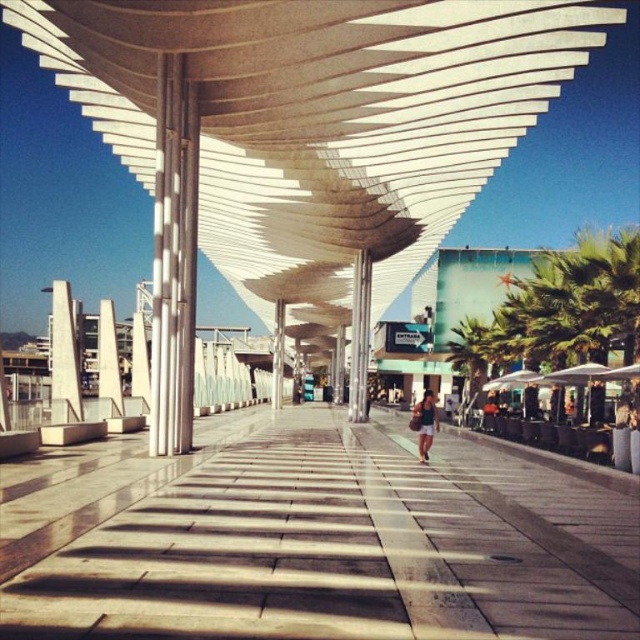
You are a photographer standing at the edge of the plaza, aiming to capture the architectural canopy and the objects on the ground. Which object, the white polished stone pavement at center or the matte black shorts at center, is closer to the camera based on their height?

The matte black shorts at center is taller than the white polished stone pavement at center, so the matte black shorts at center is closer to the camera.

You are a pedestrian walking on the white polished stone pavement at center and the matte black shorts at center. Which surface is more likely to reflect sunlight and cause glare?

The white polished stone pavement at center is positioned under matte black shorts at center. Since white polished stone is more reflective than matte black material, the white polished stone pavement at center is more likely to reflect sunlight and cause glare.

You are standing at the edge of the plaza and want to walk towards the white polished stone pavement at center and the matte black shorts at center. Which object will you encounter first?

You will encounter the white polished stone pavement at center first because it is closer to you than the matte black shorts at center.